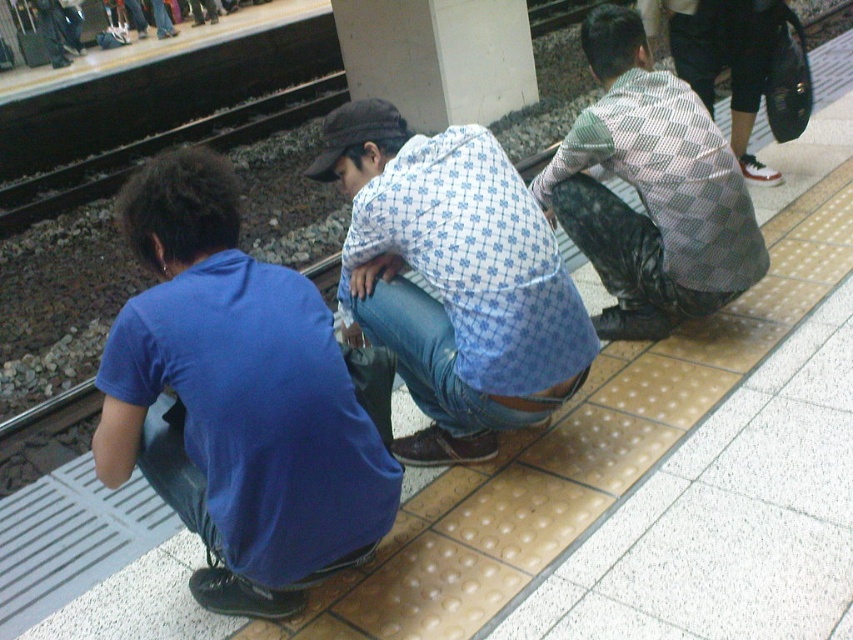
Question: Where is blue cotton shirt at lower left located in relation to blue printed shirt at center in the image?

Choices:
 (A) right
 (B) left

Answer: (B)

Question: Can you confirm if blue cotton shirt at lower left is wider than blue printed shirt at center?

Choices:
 (A) yes
 (B) no

Answer: (B)

Question: Estimate the real-world distances between objects in this image. Which object is farther from the blue printed shirt at center?

Choices:
 (A) checkered fabric shirt at center
 (B) blue cotton shirt at lower left

Answer: (A)

Question: Does blue cotton shirt at lower left appear over checkered fabric shirt at center?

Choices:
 (A) no
 (B) yes

Answer: (A)

Question: Which of the following is the closest to the observer?

Choices:
 (A) (115, 465)
 (B) (413, 164)
 (C) (642, 172)

Answer: (A)

Question: Which of the following is the closest to the observer?

Choices:
 (A) blue printed shirt at center
 (B) blue cotton shirt at lower left
 (C) checkered fabric shirt at center

Answer: (B)